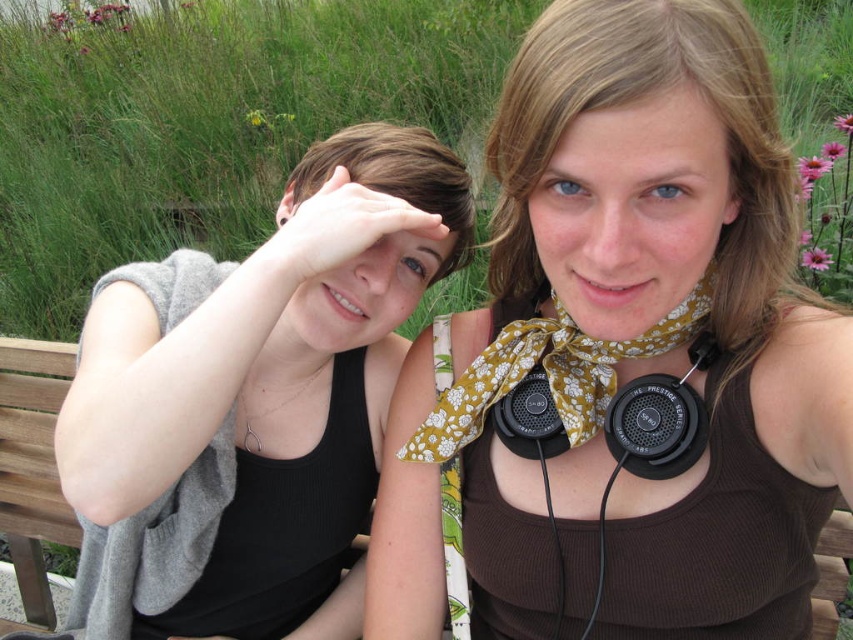
Question: Can you confirm if brown ribbed tank top at center is smaller than skinsmoothneck at center?

Choices:
 (A) yes
 (B) no

Answer: (B)

Question: Considering the relative positions of brown ribbed tank top at center and matte black tank top at center in the image provided, where is brown ribbed tank top at center located with respect to matte black tank top at center?

Choices:
 (A) right
 (B) left

Answer: (A)

Question: Estimate the real-world distances between objects in this image. Which object is farther from the skinsmoothneck at center?

Choices:
 (A) black matte earphone at upper center
 (B) smooth brown hair at center
 (C) brown hair at upper left
 (D) pale skin ear at center

Answer: (D)

Question: From the image, what is the correct spatial relationship of pale skin ear at center in relation to black matte earphone at upper center?

Choices:
 (A) below
 (B) above

Answer: (A)

Question: Which object is the farthest from the brown ribbed tank top at center?

Choices:
 (A) black matte earphone at upper center
 (B) smooth brown hair at center
 (C) brown hair at upper left
 (D) floral yellow scarf at center

Answer: (A)

Question: Which point appears farthest from the camera in this image?

Choices:
 (A) (460, 209)
 (B) (344, 177)
 (C) (273, 324)
 (D) (445, 428)

Answer: (A)